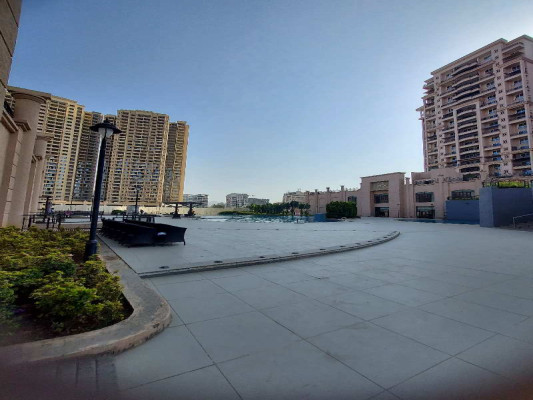
The width and height of the screenshot is (533, 400). Identify the location of blue wall. coord(492,205), coord(456,212).